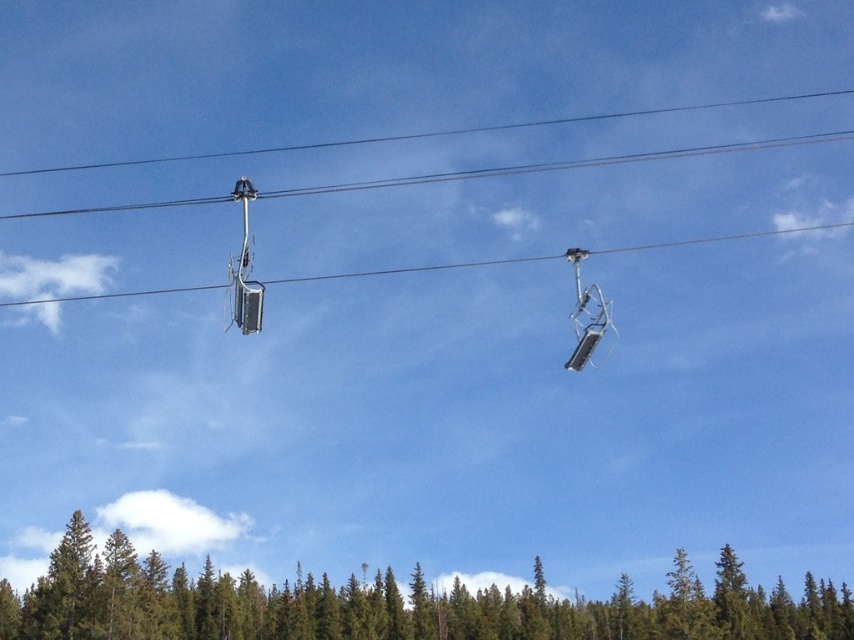
Which is above, green textured pine forest at lower center or metallic gray ski lift at upper center?

Positioned higher is metallic gray ski lift at upper center.

Can you confirm if green textured pine forest at lower center is bigger than metallic gray ski lift at upper center?

Yes, green textured pine forest at lower center is bigger than metallic gray ski lift at upper center.

This screenshot has height=640, width=854. Describe the element at coordinates (389, 604) in the screenshot. I see `green textured pine forest at lower center` at that location.

Locate an element on the screen. This screenshot has height=640, width=854. green textured pine forest at lower center is located at coordinates (389, 604).

Can you confirm if metallic gray ski lift at upper center is thinner than metallic silver ski lift at upper center?

No.

Does metallic gray ski lift at upper center have a lesser height compared to metallic silver ski lift at upper center?

No, metallic gray ski lift at upper center is not shorter than metallic silver ski lift at upper center.

Which is behind, point (254, 296) or point (600, 294)?

The point (600, 294) is behind.

I want to click on metallic gray ski lift at upper center, so click(x=244, y=269).

Measure the distance between green textured pine forest at lower center and metallic silver ski lift at upper center.

green textured pine forest at lower center and metallic silver ski lift at upper center are 46.03 meters apart from each other.

Is green textured pine forest at lower center smaller than metallic silver ski lift at upper center?

No, green textured pine forest at lower center is not smaller than metallic silver ski lift at upper center.

Who is more forward, (843, 589) or (588, 358)?

Positioned in front is point (588, 358).

This screenshot has height=640, width=854. Identify the location of green textured pine forest at lower center. (389, 604).